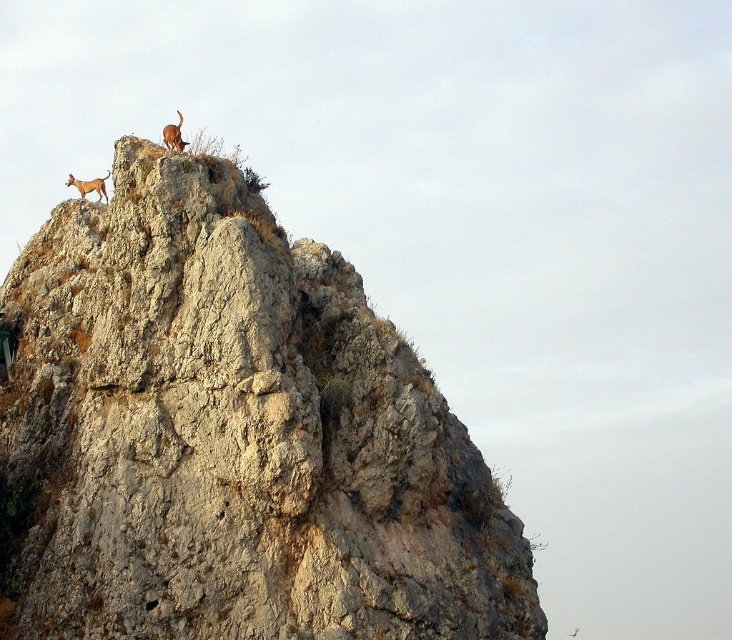
Question: Which point appears farthest from the camera in this image?

Choices:
 (A) (82, 186)
 (B) (173, 125)

Answer: (A)

Question: Which object is closer to the camera taking this photo?

Choices:
 (A) rough textured rock at upper center
 (B) brown fur dog at upper left
 (C) brown fur dog at upper center

Answer: (A)

Question: Is brown fur dog at upper left in front of brown fur dog at upper center?

Choices:
 (A) yes
 (B) no

Answer: (B)

Question: Observing the image, what is the correct spatial positioning of rough textured rock at upper center in reference to brown fur dog at upper center?

Choices:
 (A) left
 (B) right

Answer: (B)

Question: Which object is positioned closest to the rough textured rock at upper center?

Choices:
 (A) brown fur dog at upper center
 (B) brown fur dog at upper left

Answer: (A)

Question: Can you confirm if rough textured rock at upper center is smaller than brown fur dog at upper left?

Choices:
 (A) yes
 (B) no

Answer: (B)